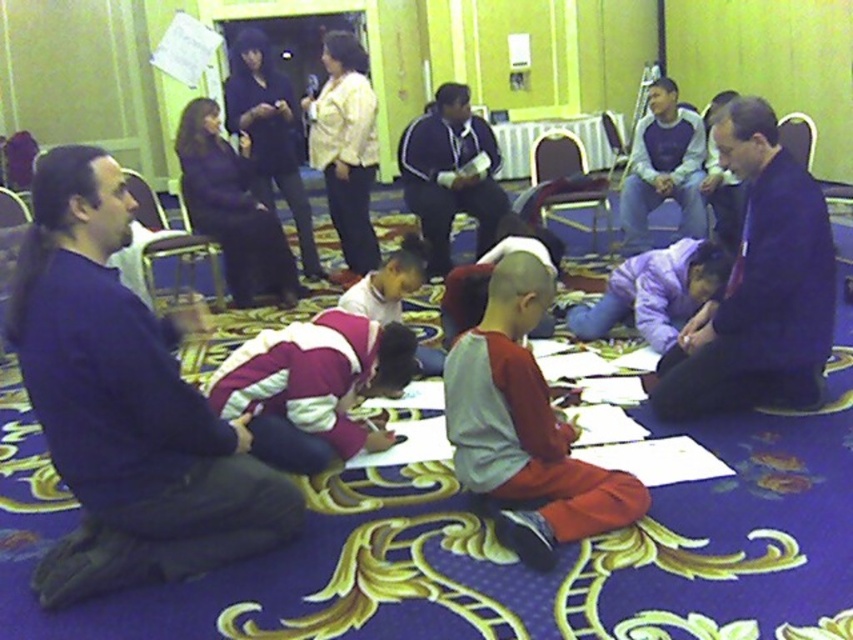
Question: Does gray fleece sweater at center appear on the right side of dark blue sweater at center?

Choices:
 (A) yes
 (B) no

Answer: (A)

Question: Which is farther from the purple fleece jacket at center?

Choices:
 (A) purple sweater at left
 (B) dark blue fabric at center
 (C) dark blue shirt at center

Answer: (C)

Question: Does dark blue sweater at center appear under dark blue shirt at center?

Choices:
 (A) yes
 (B) no

Answer: (A)

Question: Among these objects, which one is farthest from the camera?

Choices:
 (A) dark blue shirt at center
 (B) maroon fleece jacket at center

Answer: (A)

Question: Which of these objects is positioned farthest from the maroon fleece jacket at center?

Choices:
 (A) purple fleece jacket at center
 (B) dark blue fabric at center
 (C) gray fleece sweater at center

Answer: (A)

Question: Is maroon fleece jacket at center thinner than gray sweatshirt at center?

Choices:
 (A) yes
 (B) no

Answer: (B)